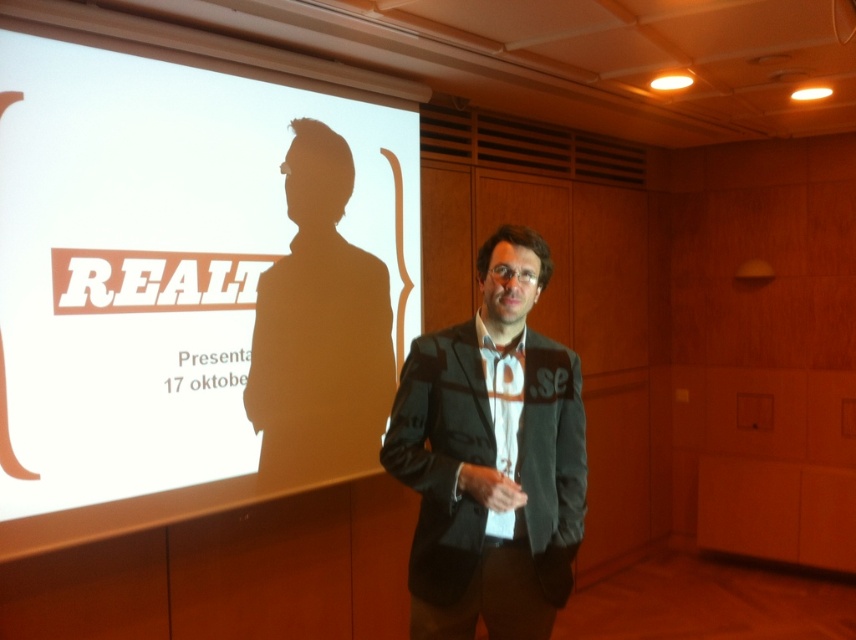
Which is behind, point (173, 163) or point (414, 636)?

Positioned behind is point (173, 163).

Does point (200, 410) lie behind point (508, 545)?

Yes, point (200, 410) is farther from viewer.

Who is more distant from viewer, [209,289] or [533,529]?

The point [209,289] is behind.

This screenshot has width=856, height=640. What are the coordinates of `white matte projection screen at upper left` in the screenshot? It's located at (155, 260).

Which is above, dark gray suit at center or black matte suit at center?

Positioned higher is black matte suit at center.

Is dark gray suit at center in front of black matte suit at center?

Yes, dark gray suit at center is in front of black matte suit at center.

Does point (518, 548) lie in front of point (361, 468)?

Yes, it is.

Where is `dark gray suit at center`? dark gray suit at center is located at coordinates (491, 458).

Which of these two, white matte projection screen at upper left or black matte suit at center, stands shorter?

Standing shorter between the two is black matte suit at center.

Who is positioned more to the left, white matte projection screen at upper left or black matte suit at center?

white matte projection screen at upper left is more to the left.

The height and width of the screenshot is (640, 856). What do you see at coordinates (155, 260) in the screenshot? I see `white matte projection screen at upper left` at bounding box center [155, 260].

This screenshot has width=856, height=640. What are the coordinates of `white matte projection screen at upper left` in the screenshot? It's located at (155, 260).